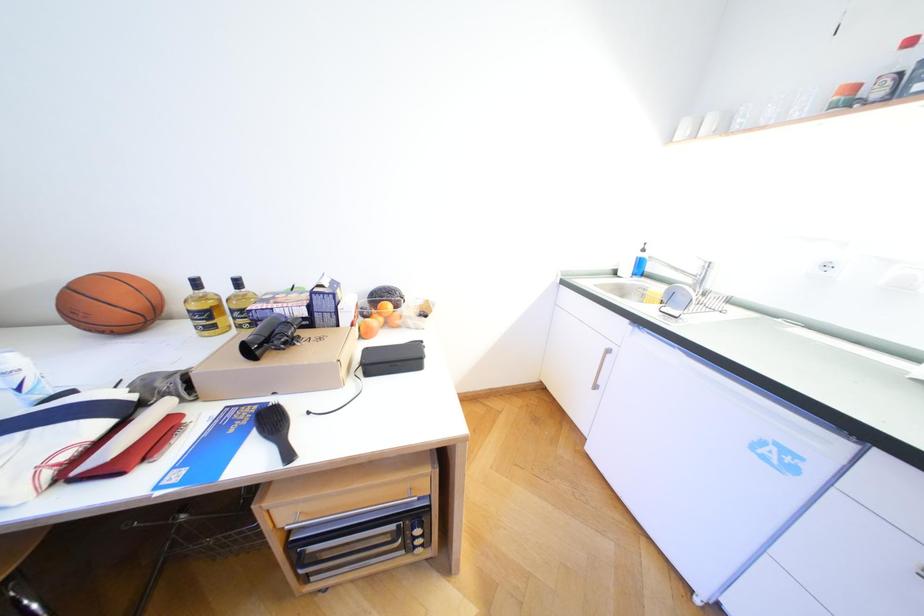
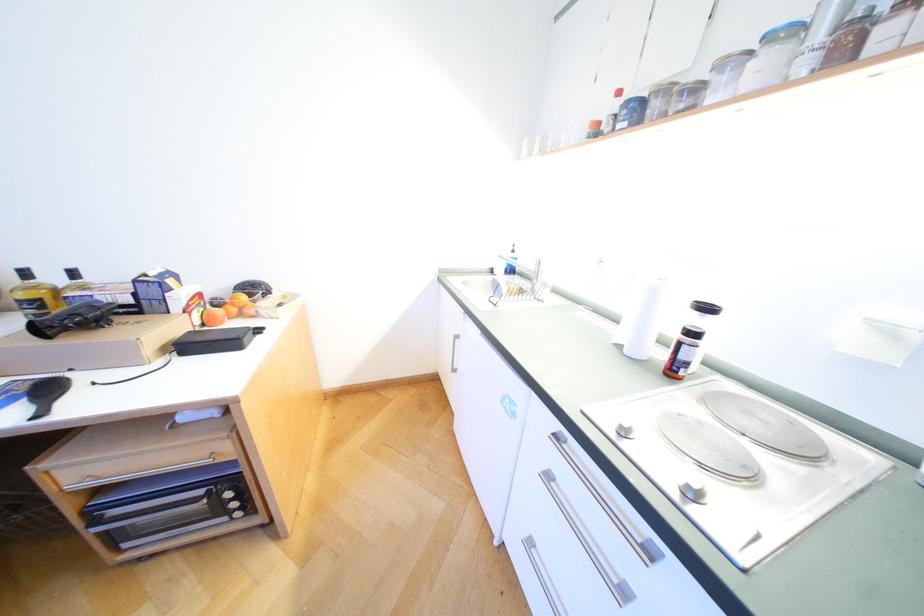
Question: The first image is from the beginning of the video and the second image is from the end. How did the camera likely rotate when shooting the video?

Choices:
 (A) Left
 (B) Right
 (C) Up
 (D) Down

Answer: (B)